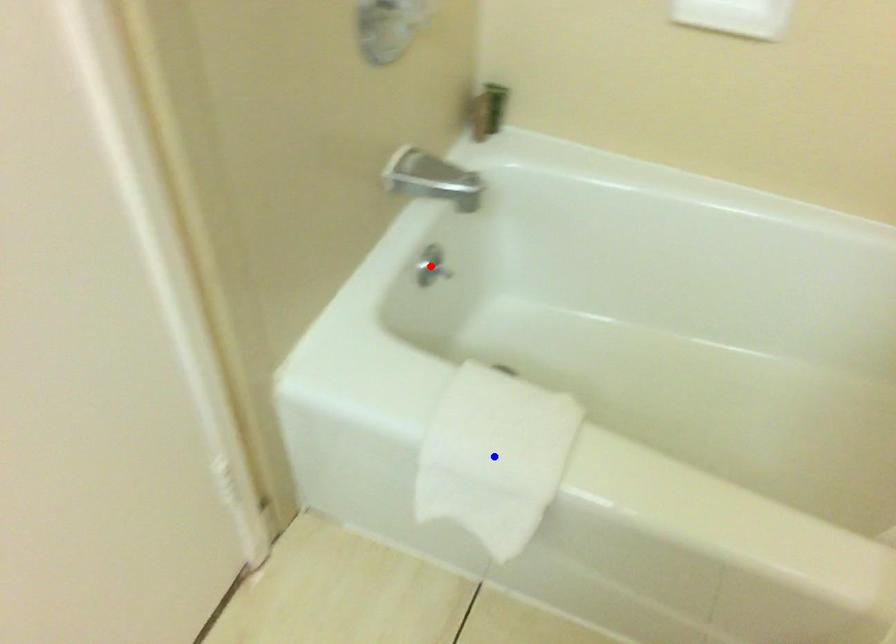
Question: Two points are marked on the image. Which point is closer to the camera?

Choices:
 (A) Blue point is closer.
 (B) Red point is closer.

Answer: (A)